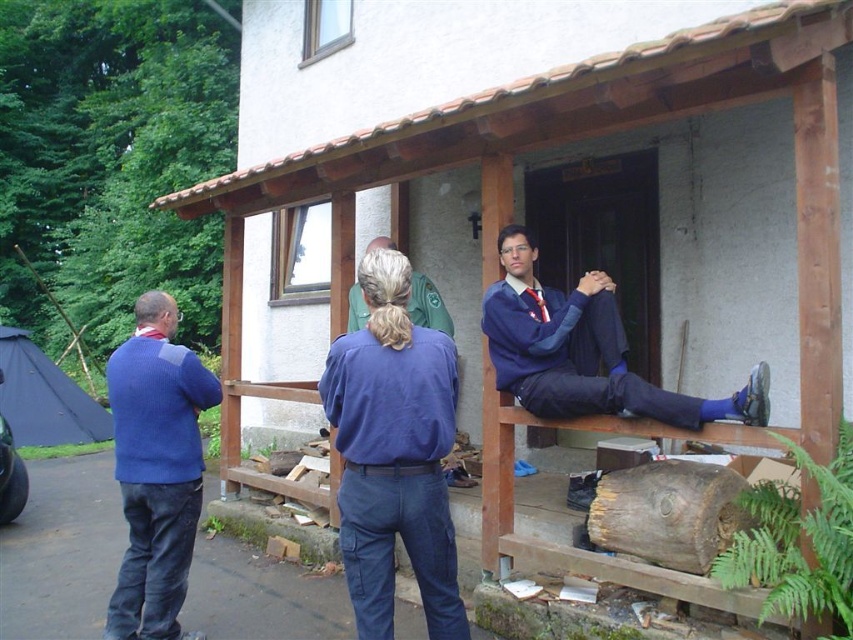
Question: Does blue knitted sweater at left appear over brown rough wood log at lower right?

Choices:
 (A) no
 (B) yes

Answer: (B)

Question: Among these points, which one is farthest from the camera?

Choices:
 (A) (146, 392)
 (B) (700, 564)
 (C) (363, 301)
 (D) (561, 307)

Answer: (C)

Question: Which of these objects is positioned farthest from the brown rough wood log at lower right?

Choices:
 (A) blue knitted sweater at left
 (B) blue fabric pants at center
 (C) green fabric jacket at center
 (D) blue cotton shirt at center

Answer: (A)

Question: Is blue knitted sweater at left to the right of blue fabric pants at center from the viewer's perspective?

Choices:
 (A) yes
 (B) no

Answer: (B)

Question: Which of the following is the farthest from the observer?

Choices:
 (A) blue knitted sweater at left
 (B) blue cotton shirt at center

Answer: (A)

Question: Is blue fabric pants at center further to camera compared to green fabric jacket at center?

Choices:
 (A) no
 (B) yes

Answer: (A)